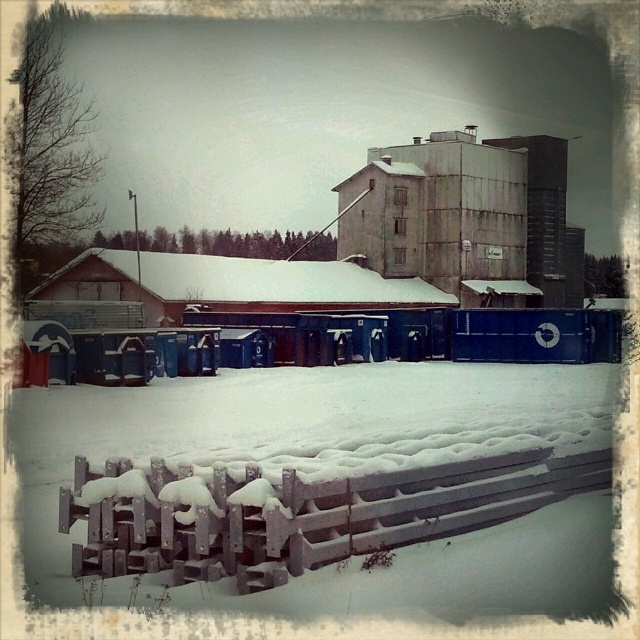
Question: Does wooden snow-covered fence at lower center have a larger size compared to rusty metal building at center?

Choices:
 (A) no
 (B) yes

Answer: (A)

Question: Which point is closer to the camera?

Choices:
 (A) rusty metal building at center
 (B) wooden snow-covered fence at lower center
 (C) snow-covered wooden barn at center

Answer: (B)

Question: Which object appears farthest from the camera in this image?

Choices:
 (A) wooden snow-covered fence at lower center
 (B) snow-covered wooden barn at center
 (C) rusty metal building at center

Answer: (C)

Question: Which object is the closest to the wooden snow-covered fence at lower center?

Choices:
 (A) snow-covered wooden barn at center
 (B) rusty metal building at center

Answer: (A)

Question: Is wooden snow-covered fence at lower center positioned behind rusty metal building at center?

Choices:
 (A) yes
 (B) no

Answer: (B)

Question: Is wooden snow-covered fence at lower center positioned at the back of rusty metal building at center?

Choices:
 (A) no
 (B) yes

Answer: (A)